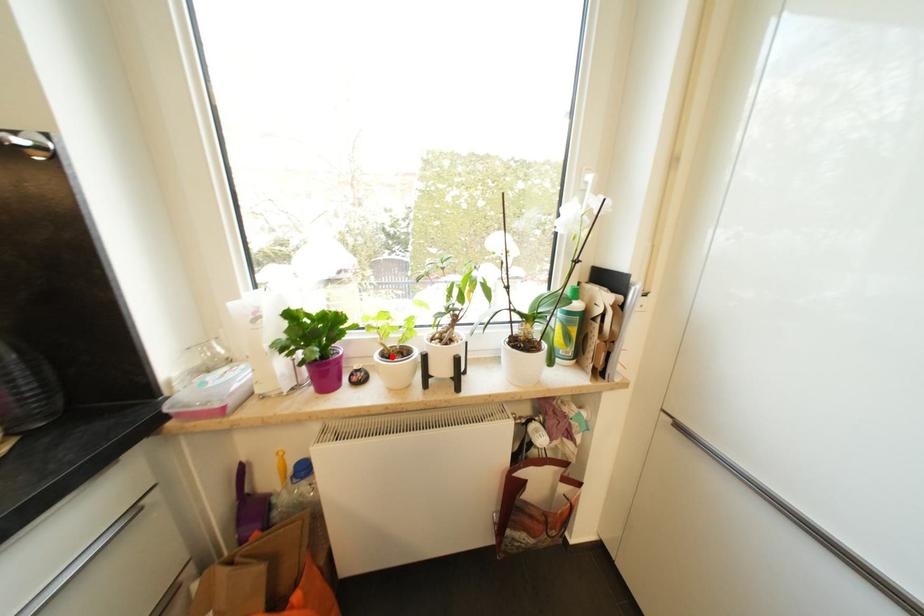
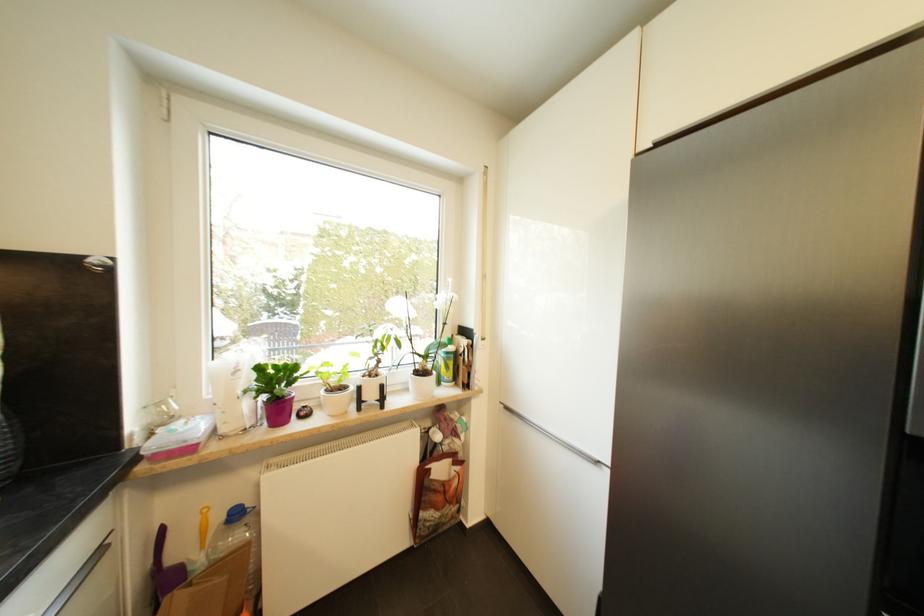
Locate, in the second image, the point that corresponds to the highlighted location in the first image.

(336, 392)